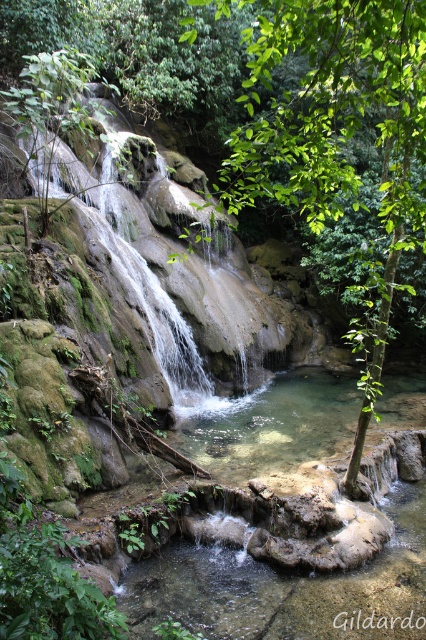
You are standing at the edge of the waterfall and see the point marked as point (x=336, y=134). What is the nearest object to this point?

The green leafy tree at center is represented by point (x=336, y=134), so the nearest object to this point is the green leafy tree at center.

You are a hiker who wants to take a photo of the green leafy tree at center and the green mossy rock at center. Which object should you focus on first if you want to capture both in one frame without moving your camera?

The green leafy tree at center is larger in size than the green mossy rock at center, so you should focus on the green leafy tree at center first to ensure it fits properly in the frame before adjusting for the smaller rock.